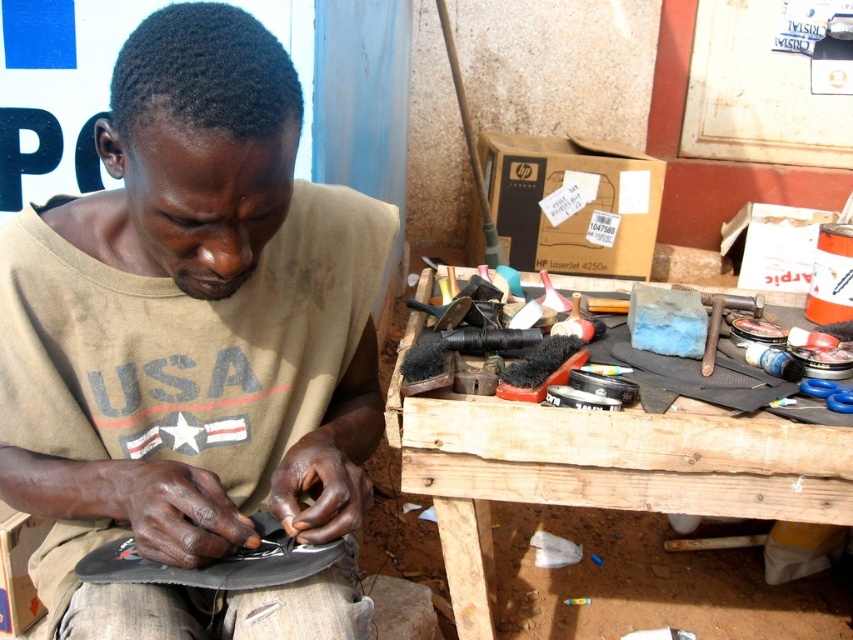
Between brown cotton shirt at center and wooden at center, which one is positioned higher?

brown cotton shirt at center is higher up.

Between point (253, 186) and point (425, 435), which one is positioned behind?

Point (425, 435)

Identify the location of brown cotton shirt at center. The width and height of the screenshot is (853, 640). (193, 342).

Is wooden at center to the left of black leather shoe at lower left from the viewer's perspective?

No, wooden at center is not to the left of black leather shoe at lower left.

Between wooden at center and black leather shoe at lower left, which one appears on the right side from the viewer's perspective?

From the viewer's perspective, wooden at center appears more on the right side.

Between point (751, 435) and point (338, 552), which one is positioned behind?

The point (751, 435) is more distant.

The height and width of the screenshot is (640, 853). Identify the location of wooden at center. (599, 468).

Is point (300, 97) positioned before point (303, 552)?

Yes, it is.

Which is in front, point (213, 371) or point (265, 515)?

Point (265, 515) is more forward.

In order to click on brown cotton shirt at center in this screenshot , I will do `click(193, 342)`.